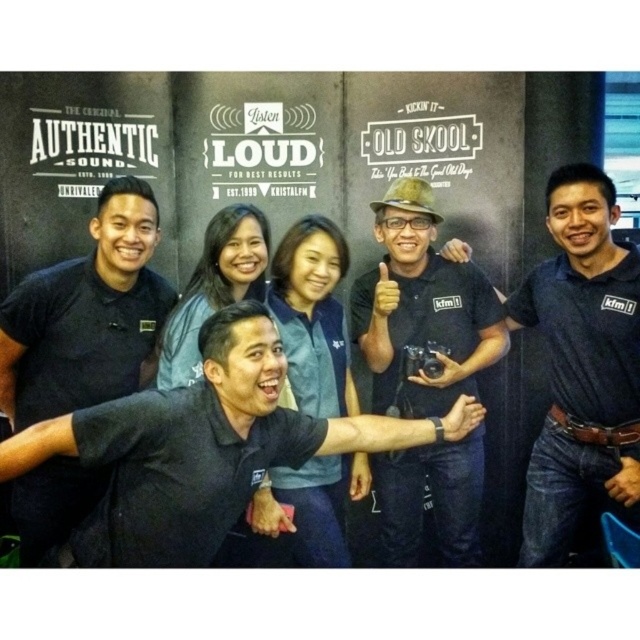
Can you confirm if dark blue shirt at center is taller than black matte shirt at left?

Yes.

Measure the distance between dark blue shirt at center and camera.

dark blue shirt at center is 33.95 meters from camera.

Where is `dark blue shirt at center`? The height and width of the screenshot is (640, 640). dark blue shirt at center is located at coordinates (580, 365).

Is black matte shirt at center taller than matte black shirt at center?

No, black matte shirt at center is not taller than matte black shirt at center.

Which is behind, point (188, 556) or point (365, 292)?

Point (365, 292)

I want to click on black matte shirt at center, so click(x=204, y=448).

What do you see at coordinates (580, 365) in the screenshot? The height and width of the screenshot is (640, 640). I see `dark blue shirt at center` at bounding box center [580, 365].

Which is in front, point (531, 308) or point (406, 220)?

Positioned in front is point (406, 220).

You are a GUI agent. You are given a task and a screenshot of the screen. Output one action in this format:
    pyautogui.click(x=<x>, y=<y>)
    Task: Click on the dark blue shirt at center
    
    Given the screenshot: What is the action you would take?
    pyautogui.click(x=580, y=365)